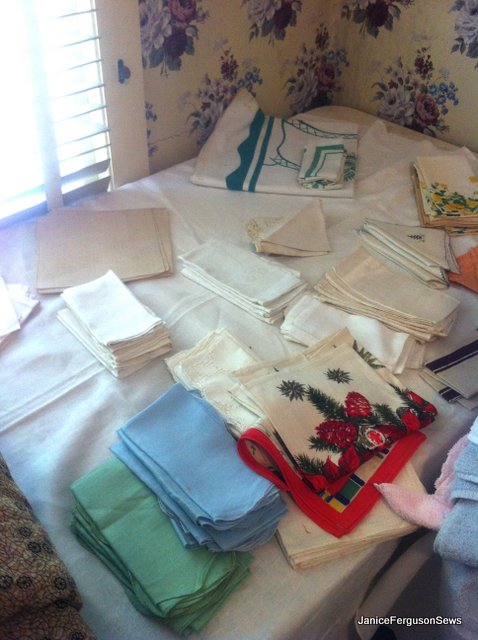
Image resolution: width=478 pixels, height=640 pixels. I want to click on tablecloth, so click(x=269, y=594), click(x=46, y=429).